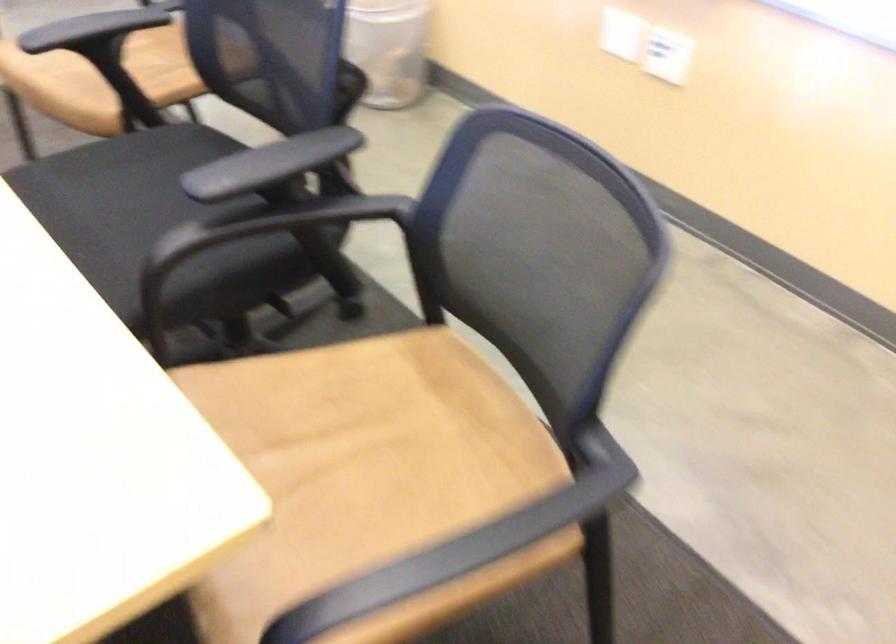
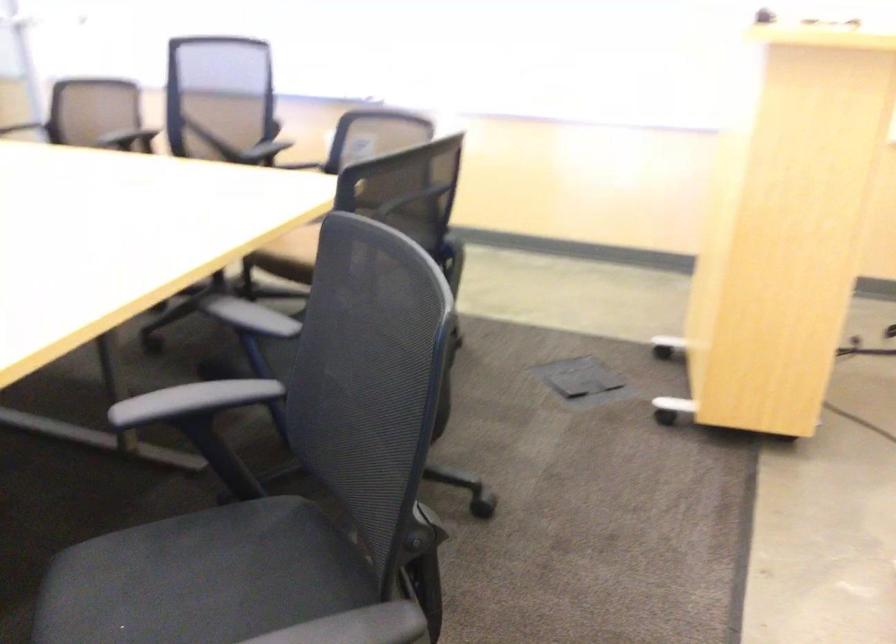
Question: I am providing you with two images of the same scene from different viewpoints. After the viewpoint changes to image2, which objects are now occluded?

Choices:
 (A) black chair sitting surface
 (B) black chair armrest
 (C) acoustic guitar
 (D) brown chair sitting surface

Answer: (B)